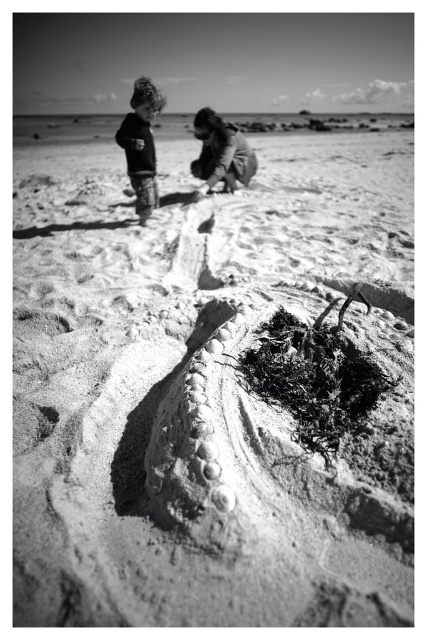
You are a photographer trying to capture a photo of the smooth fabric child at upper center. To avoid blocking the sunlight, you need to position yourself so that the matte black jacket at upper left is not in the frame. Based on their positions, which direction should you move relative to the current camera position?

Since the matte black jacket at upper left is to the left of the smooth fabric child at upper center, you should move to the right to position yourself so that the matte black jacket at upper left is out of the frame while keeping the smooth fabric child at upper center in view.

You are a photographer trying to capture both the matte black jacket at upper left and the smooth fabric child at upper center in a single shot. Based on their positions, which object is closer to the camera?

The smooth fabric child at upper center is closer to the camera because the matte black jacket at upper left is thinner, indicating it is further away.

You are a photographer trying to capture a photo of the sandcastle. You notice the matte black jacket at upper left and the smooth fabric child at upper center are blocking your view. Which object should you move to get a clearer shot of the sandcastle?

You should move the matte black jacket at upper left because it is much taller than the smooth fabric child at upper center, so it is blocking more of the view.